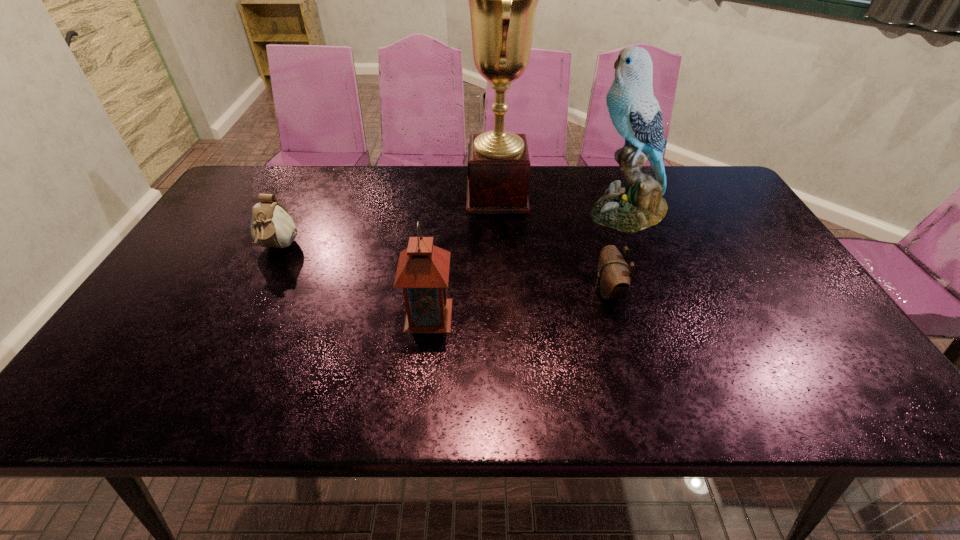
Locate an element on the screen. the tallest object is located at coordinates (503, 0).

In order to click on the third object from right to left in this screenshot , I will do `click(503, 0)`.

The image size is (960, 540). Identify the location of the second tallest object. [x=635, y=113].

The width and height of the screenshot is (960, 540). In order to click on lantern in this screenshot , I will do `click(423, 269)`.

Where is `the third tallest object`? The image size is (960, 540). the third tallest object is located at coordinates (423, 269).

Locate an element on the screen. the farther pouch is located at coordinates (271, 226).

Image resolution: width=960 pixels, height=540 pixels. I want to click on the leftmost object, so click(x=271, y=226).

At what (x,y) coordinates should I click in order to perform the action: click on the right pouch. Please return your answer as a coordinate pair (x, y). The height and width of the screenshot is (540, 960). Looking at the image, I should click on (613, 280).

Find the location of a particular element. the shorter pouch is located at coordinates (613, 280).

I want to click on vacant space situated on the plaque of the trophy cup, so click(x=398, y=195).